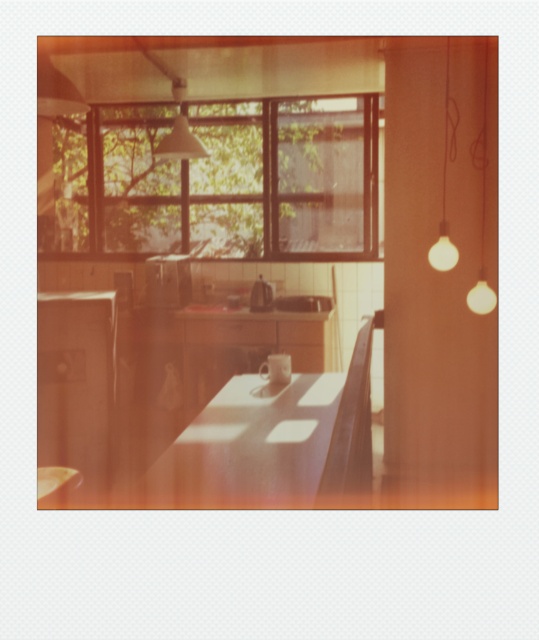
Question: Which of the following is the closest to the observer?

Choices:
 (A) matte white bulb at upper right
 (B) matte white lampshade at upper center

Answer: (A)

Question: Is matte glass bulb at right to the left of matte white lampshade at upper center from the viewer's perspective?

Choices:
 (A) no
 (B) yes

Answer: (A)

Question: Which of the following is the closest to the observer?

Choices:
 (A) matte glass bulb at right
 (B) matte white bulb at upper right
 (C) matte white lampshade at upper center
 (D) transparent glass window at upper center

Answer: (A)

Question: Estimate the real-world distances between objects in this image. Which object is closer to the matte glass bulb at right?

Choices:
 (A) transparent glass window at upper center
 (B) matte white bulb at upper right

Answer: (B)

Question: Is white glossy table at center above matte glass bulb at right?

Choices:
 (A) no
 (B) yes

Answer: (A)

Question: Does transparent glass window at upper center have a lesser width compared to matte white bulb at upper right?

Choices:
 (A) no
 (B) yes

Answer: (A)